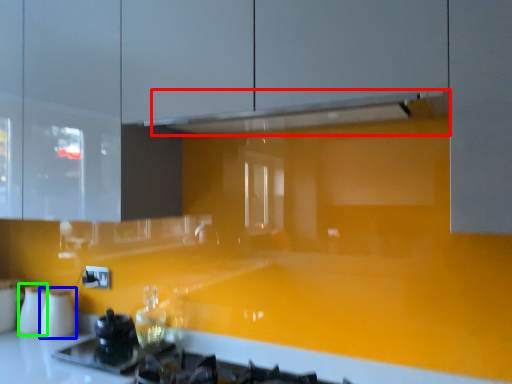
Question: Which is nearer to the exhaust hood (highlighted by a red box)? appliance (highlighted by a blue box) or appliance (highlighted by a green box).

Choices:
 (A) appliance
 (B) appliance

Answer: (A)